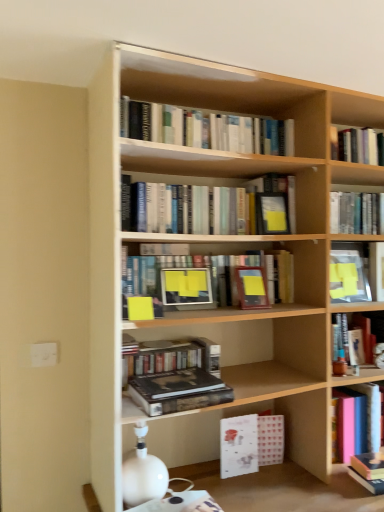
Locate an element on the screen. The image size is (384, 512). free spot above hardcover book at center, the 2th paperback book positioned from the top (from a real-world perspective) is located at coordinates (180, 376).